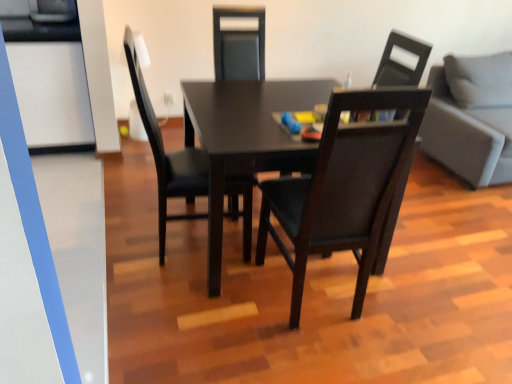
Question: Can you confirm if matte black chair at center, which is the third chair from right to left, is taller than transparent glass door at left?

Choices:
 (A) no
 (B) yes

Answer: (B)

Question: Does matte black chair at center, which is the third chair from right to left, lie behind transparent glass door at left?

Choices:
 (A) no
 (B) yes

Answer: (B)

Question: From a real-world perspective, is matte black chair at center, which is the third chair from right to left, located beneath transparent glass door at left?

Choices:
 (A) yes
 (B) no

Answer: (A)

Question: Does matte black chair at center, which is the third chair from right to left, have a smaller size compared to transparent glass door at left?

Choices:
 (A) no
 (B) yes

Answer: (A)

Question: Is matte black chair at center, which is the third chair from right to left, far away from transparent glass door at left?

Choices:
 (A) no
 (B) yes

Answer: (A)

Question: Is gray fabric couch at right taller or shorter than transparent glass door at left?

Choices:
 (A) short
 (B) tall

Answer: (B)

Question: In terms of size, does gray fabric couch at right appear bigger or smaller than transparent glass door at left?

Choices:
 (A) small
 (B) big

Answer: (B)

Question: From the image's perspective, is gray fabric couch at right above or below transparent glass door at left?

Choices:
 (A) above
 (B) below

Answer: (A)

Question: Visually, is gray fabric couch at right positioned to the left or to the right of transparent glass door at left?

Choices:
 (A) right
 (B) left

Answer: (A)

Question: Is matte black chair at center, the third chair when ordered from left to right, wider or thinner than matte black table at center?

Choices:
 (A) thin
 (B) wide

Answer: (A)

Question: From a real-world perspective, relative to matte black table at center, is matte black chair at center, the first chair in the right-to-left sequence, vertically above or below?

Choices:
 (A) below
 (B) above

Answer: (B)

Question: Would you say matte black chair at center, the first chair in the right-to-left sequence, is to the left or to the right of matte black table at center in the picture?

Choices:
 (A) right
 (B) left

Answer: (A)

Question: Would you say matte black chair at center, the third chair when ordered from left to right, is inside or outside matte black table at center?

Choices:
 (A) outside
 (B) inside

Answer: (B)

Question: Is matte black table at center taller or shorter than matte black chair at center, the third chair when ordered from left to right?

Choices:
 (A) tall
 (B) short

Answer: (B)

Question: Considering the positions of matte black table at center and matte black chair at center, the third chair when ordered from left to right, in the image, is matte black table at center bigger or smaller than matte black chair at center, the third chair when ordered from left to right,?

Choices:
 (A) small
 (B) big

Answer: (B)